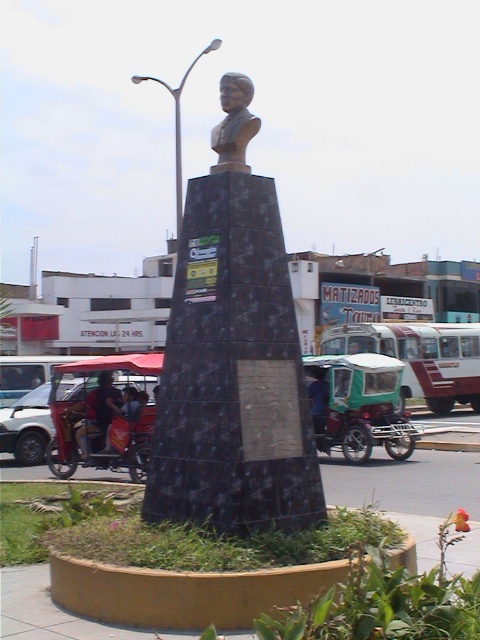
Question: Where is silver metallic lamp post at upper center located in relation to dark blue fabric shirt at center in the image?

Choices:
 (A) left
 (B) right

Answer: (A)

Question: Is bronze bust at center below dark blue fabric shirt at center?

Choices:
 (A) no
 (B) yes

Answer: (A)

Question: In this image, where is black marble bust at center located relative to green plastic motorcycle at center?

Choices:
 (A) right
 (B) left

Answer: (B)

Question: Which is farther from the dark blue fabric shirt at center?

Choices:
 (A) black marble bust at center
 (B) metallic helmet at center

Answer: (A)

Question: Which of the following is the farthest from the observer?

Choices:
 (A) (227, 147)
 (B) (394, 433)
 (C) (113, 433)

Answer: (B)

Question: Which object is closer to the camera taking this photo?

Choices:
 (A) dark blue fabric shirt at center
 (B) bronze bust at center

Answer: (B)